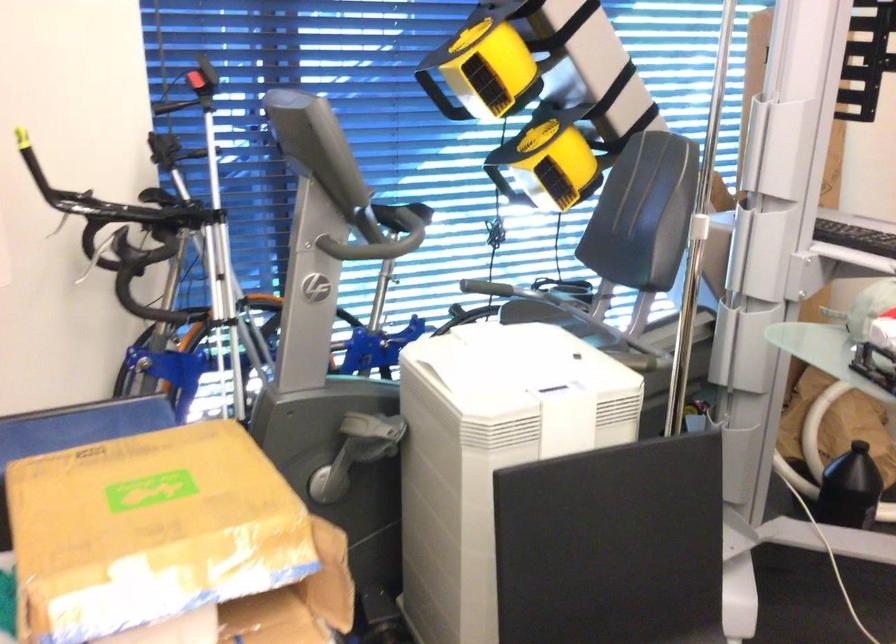
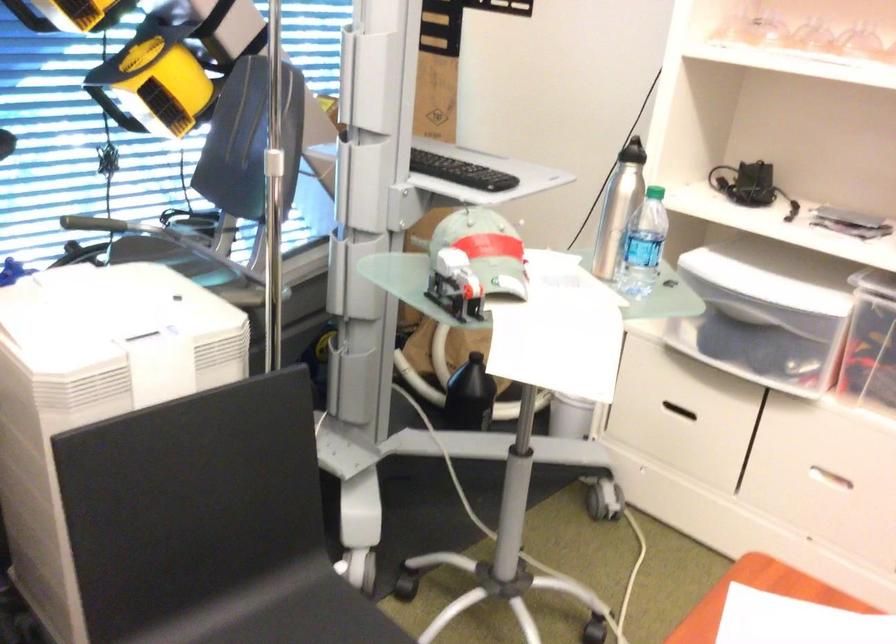
Question: The images are taken continuously from a first-person perspective. In which direction are you moving?

Choices:
 (A) Left
 (B) Right
 (C) Forward
 (D) Backward

Answer: (B)